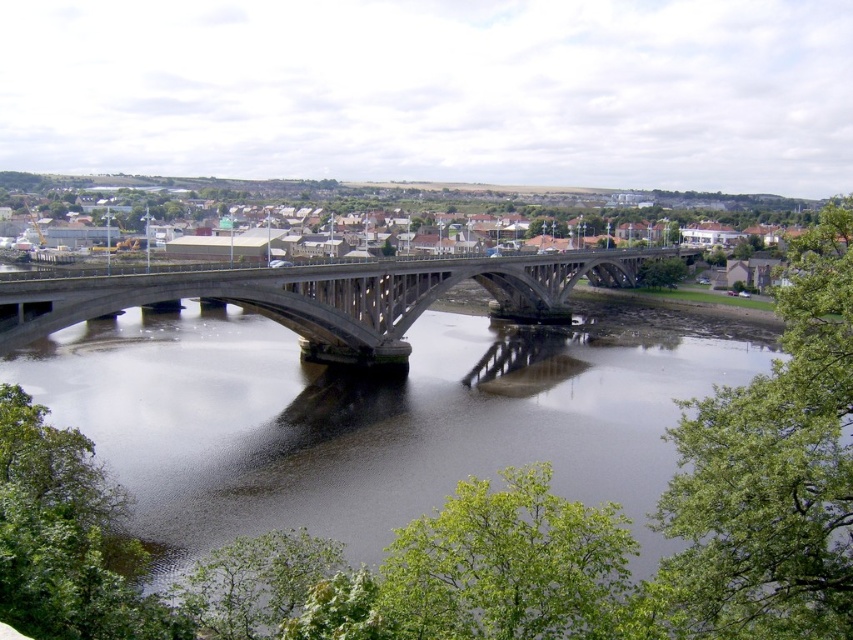
How distant is brown concrete river at center from concrete bridge at center?

brown concrete river at center and concrete bridge at center are 23.43 meters apart.

Identify the location of brown concrete river at center. The image size is (853, 640). (358, 429).

Locate an element on the screen. This screenshot has height=640, width=853. brown concrete river at center is located at coordinates (358, 429).